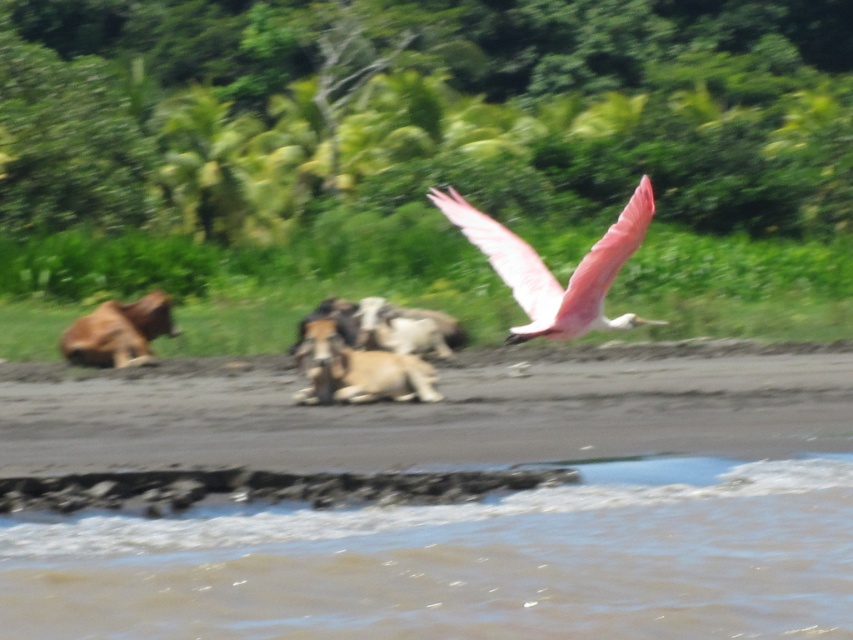
Does brown fur at center come behind white woolen goat at center?

No, brown fur at center is in front of white woolen goat at center.

The height and width of the screenshot is (640, 853). Describe the element at coordinates (358, 371) in the screenshot. I see `brown fur at center` at that location.

Is point (361, 353) positioned after point (363, 314)?

No, it is in front of (363, 314).

Locate an element on the screen. brown fur at center is located at coordinates (358, 371).

In the scene shown: Is brown muddy water at lower center above brown fur dog at left?

Incorrect, brown muddy water at lower center is not positioned above brown fur dog at left.

Who is positioned more to the left, brown muddy water at lower center or brown fur dog at left?

Positioned to the left is brown fur dog at left.

Who is more distant from viewer, (759, 557) or (71, 340)?

Positioned behind is point (71, 340).

Image resolution: width=853 pixels, height=640 pixels. I want to click on brown muddy water at lower center, so click(463, 563).

Who is more distant from viewer, (450, 630) or (407, 312)?

The point (407, 312) is more distant.

This screenshot has width=853, height=640. I want to click on brown muddy water at lower center, so click(x=463, y=563).

Is point (428, 604) positioned before point (404, 332)?

Yes.

You are a GUI agent. You are given a task and a screenshot of the screen. Output one action in this format:
    pyautogui.click(x=<x>, y=<y>)
    Task: Click on the brown muddy water at lower center
    Image resolution: width=853 pixels, height=640 pixels.
    Given the screenshot: What is the action you would take?
    pyautogui.click(x=463, y=563)